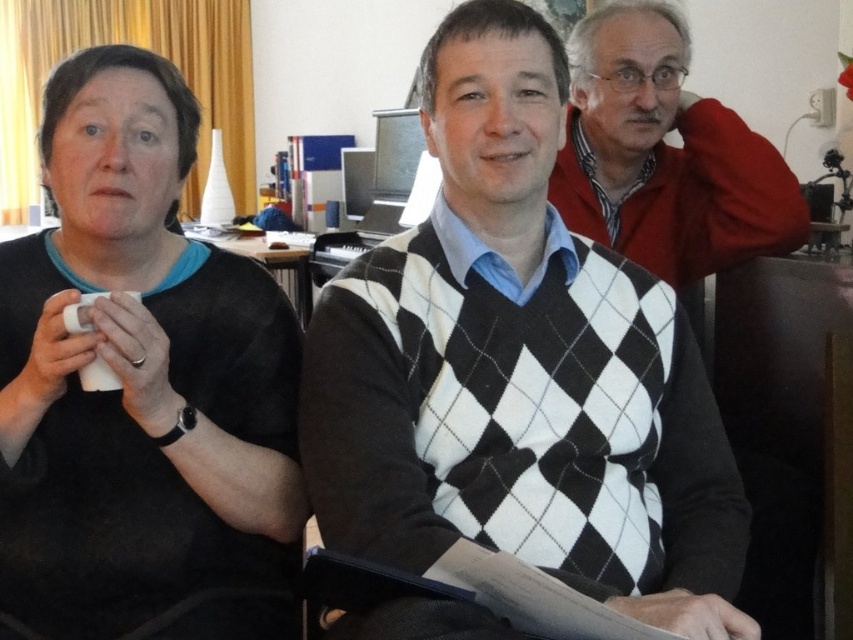
You are trying to decide which sweater to wear today. You have the black matte sweater at left and the matte red sweater at upper right. Which one is wider?

The matte red sweater at upper right is wider than the black matte sweater at left.

You are trying to decide which sweater to wear for a casual gathering. Both the black and white argyle sweater at center and the black matte sweater at left are options. Based on their heights, which one might be better if you prefer a longer coverage on your arms?

The black matte sweater at left has a greater height compared to the black and white argyle sweater at center, so it would provide longer arm coverage.